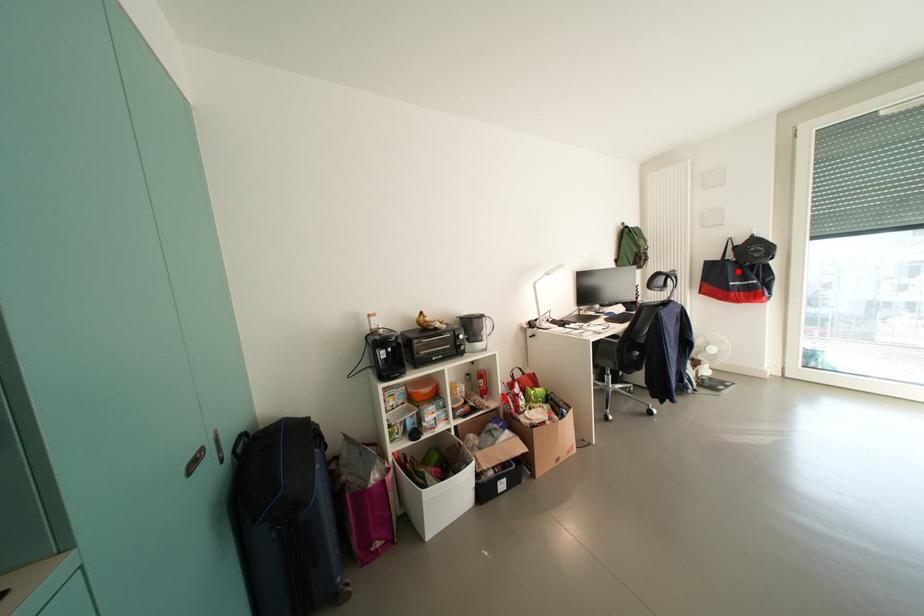
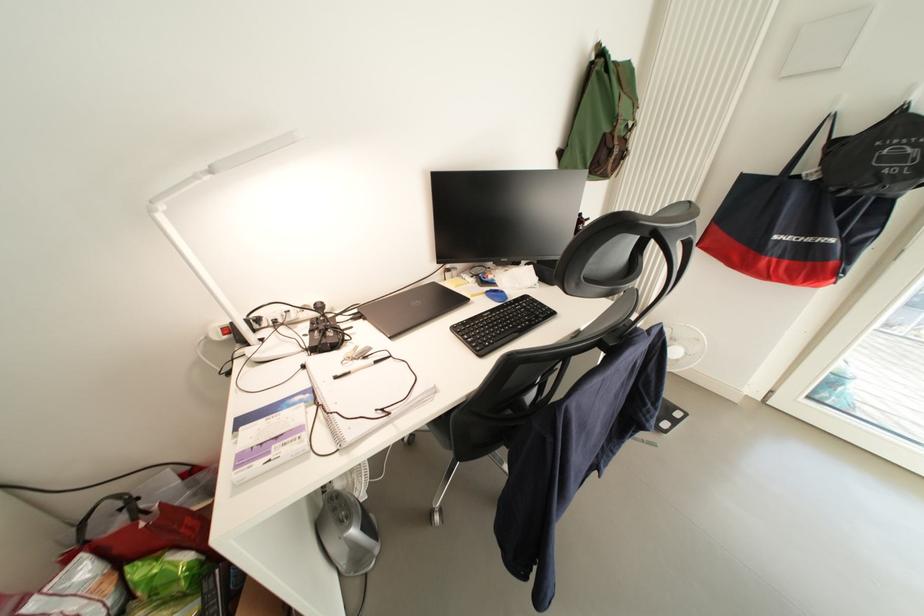
Find the pixel in the second image that matches the highlighted location in the first image.

(801, 203)